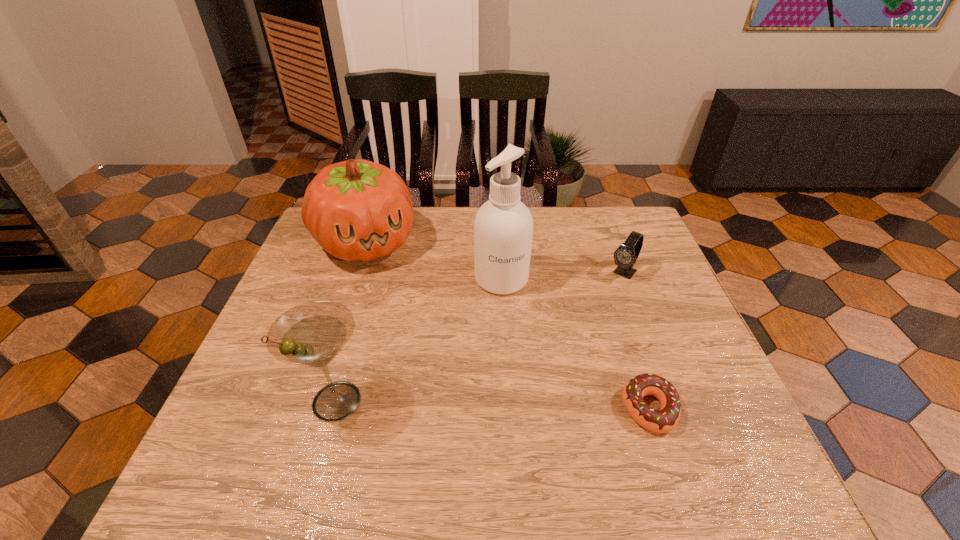
You are a GUI agent. You are given a task and a screenshot of the screen. Output one action in this format:
    pyautogui.click(x=<x>, y=<y>)
    Task: Click on the vacant space at the far right corner
    
    Given the screenshot: What is the action you would take?
    pyautogui.click(x=601, y=238)

Locate an element on the screen. vacant area that lies between the martini and the shortest object is located at coordinates (493, 405).

At what (x,y) coordinates should I click in order to perform the action: click on empty space that is in between the shortest object and the pumpkin. Please return your answer as a coordinate pair (x, y). This screenshot has height=540, width=960. Looking at the image, I should click on [x=508, y=326].

Find the location of `free space between the martini and the tallest object`. free space between the martini and the tallest object is located at coordinates (x=419, y=340).

Image resolution: width=960 pixels, height=540 pixels. I want to click on empty space that is in between the shortest object and the pumpkin, so click(x=508, y=326).

In order to click on free spot between the pumpkin and the doughnut in this screenshot , I will do `click(508, 326)`.

This screenshot has width=960, height=540. Find the location of `free space between the shortest object and the pumpkin`. free space between the shortest object and the pumpkin is located at coordinates [508, 326].

At what (x,y) coordinates should I click in order to perform the action: click on vacant area that lies between the tallest object and the martini. Please return your answer as a coordinate pair (x, y). This screenshot has height=540, width=960. Looking at the image, I should click on (419, 340).

Locate an element on the screen. free spot between the doughnut and the pumpkin is located at coordinates (508, 326).

Image resolution: width=960 pixels, height=540 pixels. In order to click on free spot between the cleansing agent and the pumpkin in this screenshot , I will do `click(434, 261)`.